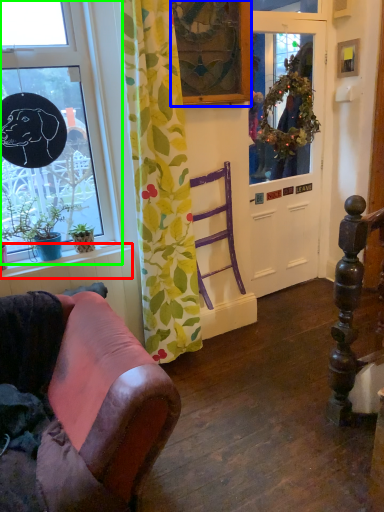
Question: Considering the real-world distances, which object is closest to window sill (highlighted by a red box)? picture frame (highlighted by a blue box) or window (highlighted by a green box).

Choices:
 (A) picture frame
 (B) window

Answer: (B)